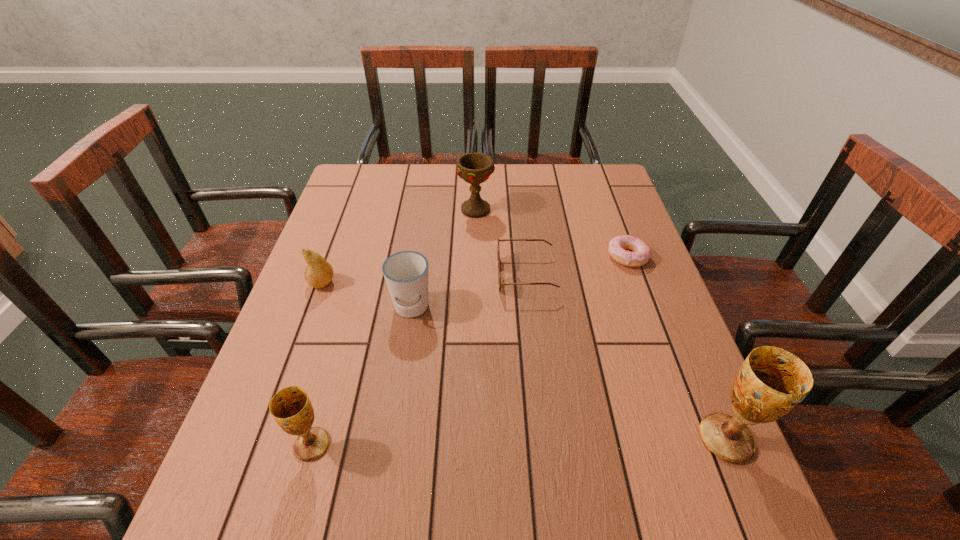
Where is `chalice that is positioned at the left edge`? chalice that is positioned at the left edge is located at coordinates (291, 408).

Where is `pear that is positioned at the left edge`? The image size is (960, 540). pear that is positioned at the left edge is located at coordinates (318, 273).

This screenshot has height=540, width=960. I want to click on chalice at the right edge, so click(x=772, y=381).

You are a GUI agent. You are given a task and a screenshot of the screen. Output one action in this format:
    pyautogui.click(x=<x>, y=<y>)
    Task: Click on the doughnut positioned at the right edge
    This screenshot has width=960, height=540.
    Given the screenshot: What is the action you would take?
    pyautogui.click(x=641, y=254)

Find the location of a particular element. Image resolution: width=960 pixels, height=540 pixels. object at the near left corner is located at coordinates (291, 408).

This screenshot has width=960, height=540. Find the location of `object located in the near right corner section of the desktop`. object located in the near right corner section of the desktop is located at coordinates (772, 381).

Find the location of a particular element. The height and width of the screenshot is (540, 960). vacant space at the far edge is located at coordinates (434, 203).

In the image, there is a desktop. At what (x,y) coordinates should I click in order to perform the action: click on free region at the near edge. Please return your answer as a coordinate pair (x, y). Image resolution: width=960 pixels, height=540 pixels. Looking at the image, I should click on (564, 441).

This screenshot has height=540, width=960. Find the location of `vacant space at the left edge of the desktop`. vacant space at the left edge of the desktop is located at coordinates (281, 343).

In the image, there is a desktop. Identify the location of vacant area at the right edge. (658, 388).